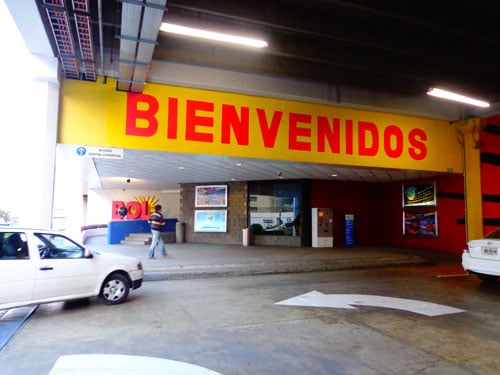
Find the location of a particular element. lights is located at coordinates (454, 98), (223, 37).